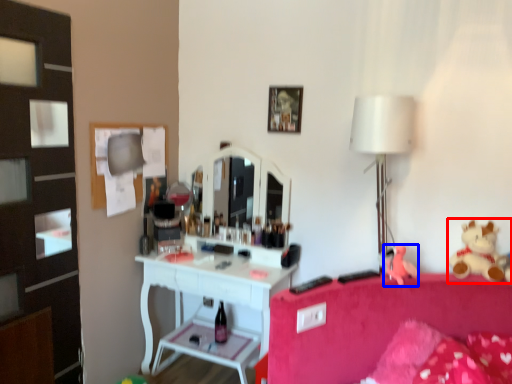
Question: Among these objects, which one is farthest to the camera, teddy bear (highlighted by a red box) or toy (highlighted by a blue box)?

Choices:
 (A) teddy bear
 (B) toy

Answer: (B)